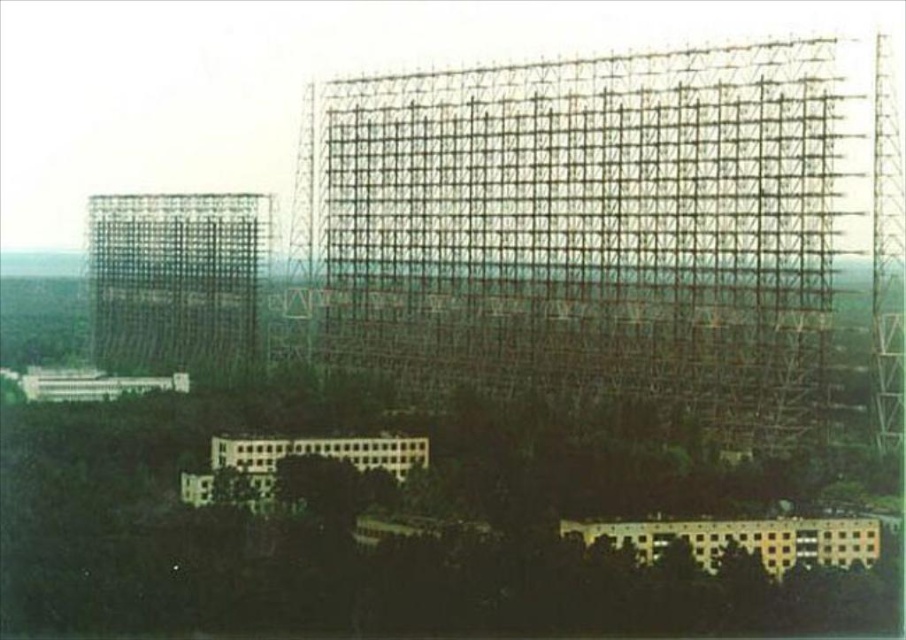
Question: From the image, what is the correct spatial relationship of metallic grid structure at center in relation to metallic grid structure at left?

Choices:
 (A) below
 (B) above

Answer: (B)

Question: Which point appears farthest from the camera in this image?

Choices:
 (A) (133, 326)
 (B) (518, 227)

Answer: (A)

Question: Is metallic grid structure at center to the right of metallic grid structure at left from the viewer's perspective?

Choices:
 (A) no
 (B) yes

Answer: (B)

Question: Is metallic grid structure at center bigger than metallic grid structure at left?

Choices:
 (A) no
 (B) yes

Answer: (B)

Question: Which point is farther to the camera?

Choices:
 (A) metallic grid structure at center
 (B) metallic grid structure at left

Answer: (B)

Question: Which point is closer to the camera?

Choices:
 (A) metallic grid structure at center
 (B) metallic grid structure at left

Answer: (A)